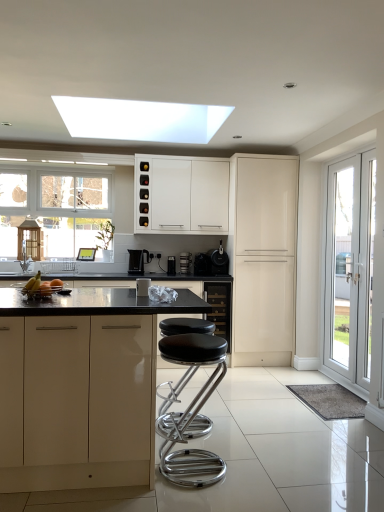
Question: Relative to matte cream cabinet at center-right, which is the third cabinetry from front to back, is black plastic kettle at center in front or behind?

Choices:
 (A) front
 (B) behind

Answer: (B)

Question: In terms of size, does black plastic kettle at center appear bigger or smaller than matte cream cabinet at center-right, which is the third cabinetry from front to back?

Choices:
 (A) big
 (B) small

Answer: (B)

Question: Which is nearer to the matte cream cabinet at center, the 4th cabinetry in the back-to-front sequence?

Choices:
 (A) black plastic kettle at center
 (B) black matte coffee maker at center, the first appliance from the right
 (C) black matte wine cooler at center, positioned as the second cabinetry in front-to-back order
 (D) yellow matte bananas at center
 (E) matte cream cabinet at center-right, which is the third cabinetry from front to back

Answer: (D)

Question: Which object is positioned farthest from the yellow matte bananas at center?

Choices:
 (A) black plastic coffee maker at center, which is counted as the second appliance, starting from the back
 (B) black matte wine cooler at center, positioned as the second cabinetry in front-to-back order
 (C) black matte coffee maker at center, the first appliance from the right
 (D) matte cream cabinet at center-right, which is counted as the second cabinetry, starting from the back
 (E) metallic silver coffee machine at center, the fifth appliance viewed from the back

Answer: (D)